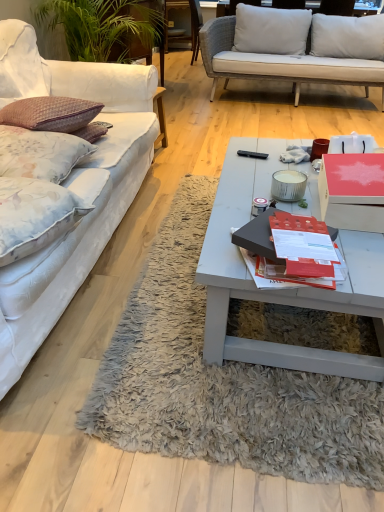
I want to click on vacant space to the left of matte gray coffee table at center, so click(x=162, y=287).